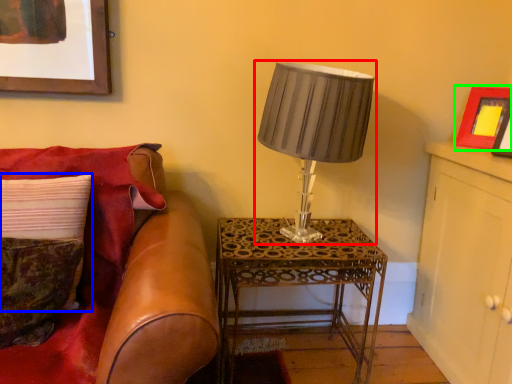
Question: Estimate the real-world distances between objects in this image. Which object is farther from lamp (highlighted by a red box), pillow (highlighted by a blue box) or picture frame (highlighted by a green box)?

Choices:
 (A) pillow
 (B) picture frame

Answer: (A)